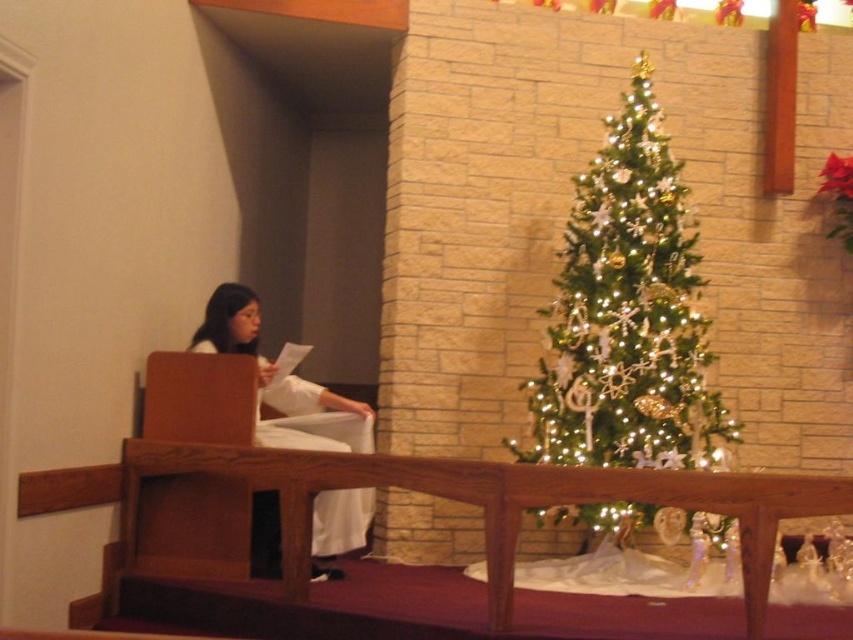
You are a photographer setting up for an event. You need to place a 1.2 meter wide backdrop between the iridescent green tree at center and the white cloth at left. Will there be enough space?

The distance between the iridescent green tree at center and the white cloth at left is 1.08 meters. Since the backdrop is 1.2 meters wide, it will not fit in the available space.

You are standing at the entrance of the venue and want to take a photo of the iridescent green tree at center. The camera you are using has a focal length of 50mm and a sensor size of 24mm x 36mm. If you want to capture the entire tree in your photo without moving closer, what is the minimum distance you should maintain from the tree?

To determine the minimum distance required to capture the entire iridescent green tree at center in the photo, we can use the formula for depth of field or the lens equation. However, without specific details about the tree height or desired depth of field, it is challenging to provide an exact distance. A general guideline is to position yourself at a distance equal to 1.5 times the focal length multiplied by the sensor size divided by the subject size. Since the exact dimensions of the tree are not given,

You are attending a Christmas event and see the iridescent green tree at center and the white cloth at left. From your perspective, which object is positioned to the right?

The iridescent green tree at center is positioned to the right of the white cloth at left.